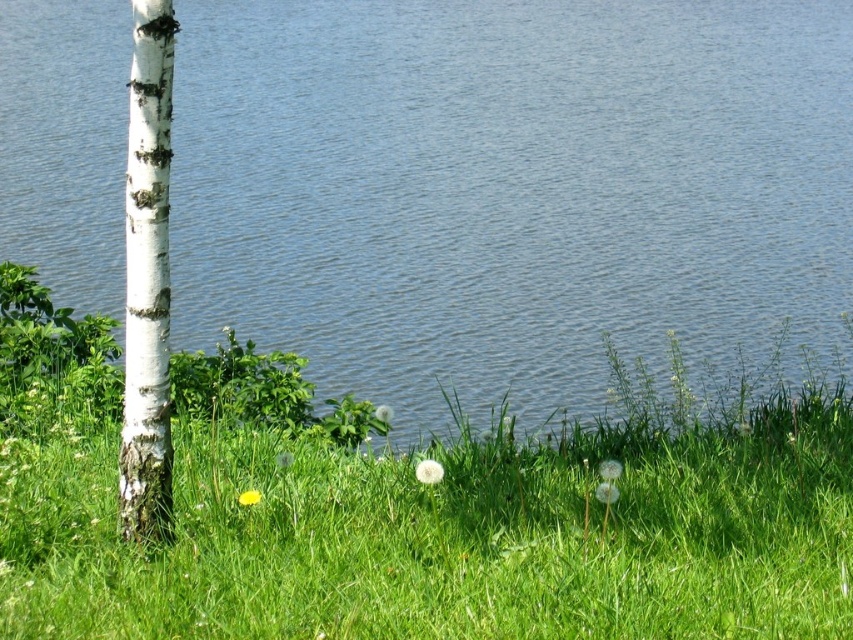
Question: Is blue water at center smaller than white bark tree at left?

Choices:
 (A) yes
 (B) no

Answer: (B)

Question: Is the position of blue water at center less distant than that of white bark tree at left?

Choices:
 (A) no
 (B) yes

Answer: (A)

Question: Does blue water at center appear on the left side of white bark tree at left?

Choices:
 (A) no
 (B) yes

Answer: (A)

Question: Which of the following is the closest to the observer?

Choices:
 (A) blue water at center
 (B) white bark tree at left

Answer: (B)